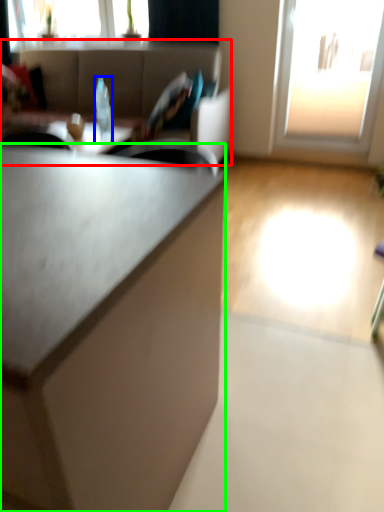
Question: Which is nearer to the studio couch (highlighted by a red box)? bottle (highlighted by a blue box) or cabinetry (highlighted by a green box).

Choices:
 (A) bottle
 (B) cabinetry

Answer: (A)